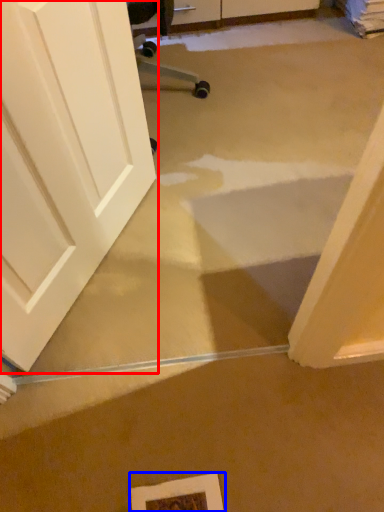
Question: Which point is further to the camera, door (highlighted by a red box) or picture frame (highlighted by a blue box)?

Choices:
 (A) door
 (B) picture frame

Answer: (B)